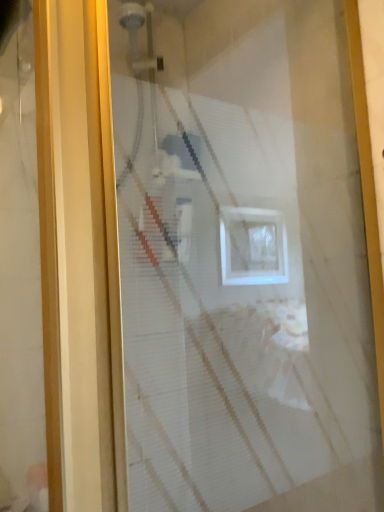
What is the approximate width of transparent glass shower door at center?

29.38 inches.

What do you see at coordinates (245, 257) in the screenshot? The image size is (384, 512). I see `transparent glass shower door at center` at bounding box center [245, 257].

Where is `transparent glass shower door at center`? transparent glass shower door at center is located at coordinates (245, 257).

Identify the location of transparent glass shower door at center. (245, 257).